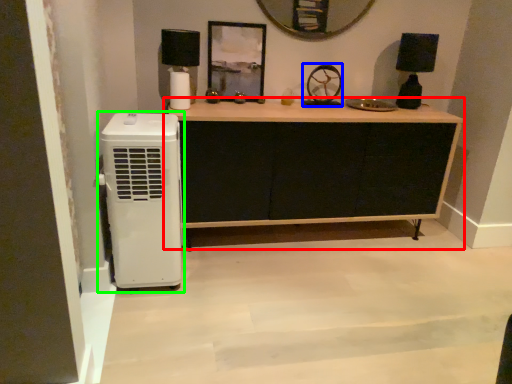
Question: Considering the real-world distances, which object is closest to chest of drawers (highlighted by a red box)? wheel (highlighted by a blue box) or home appliance (highlighted by a green box).

Choices:
 (A) wheel
 (B) home appliance

Answer: (A)